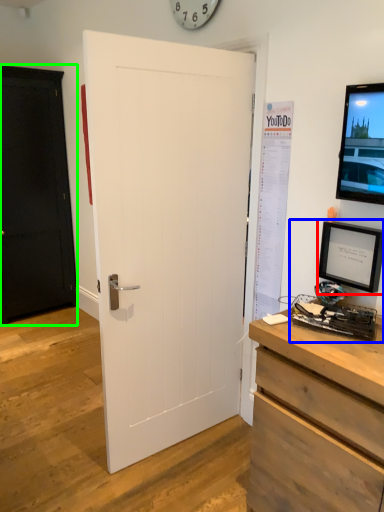
Question: Which object is the closest to the picture frame (highlighted by a red box)? Choose among these: desktop computer (highlighted by a blue box) or door (highlighted by a green box).

Choices:
 (A) desktop computer
 (B) door

Answer: (A)